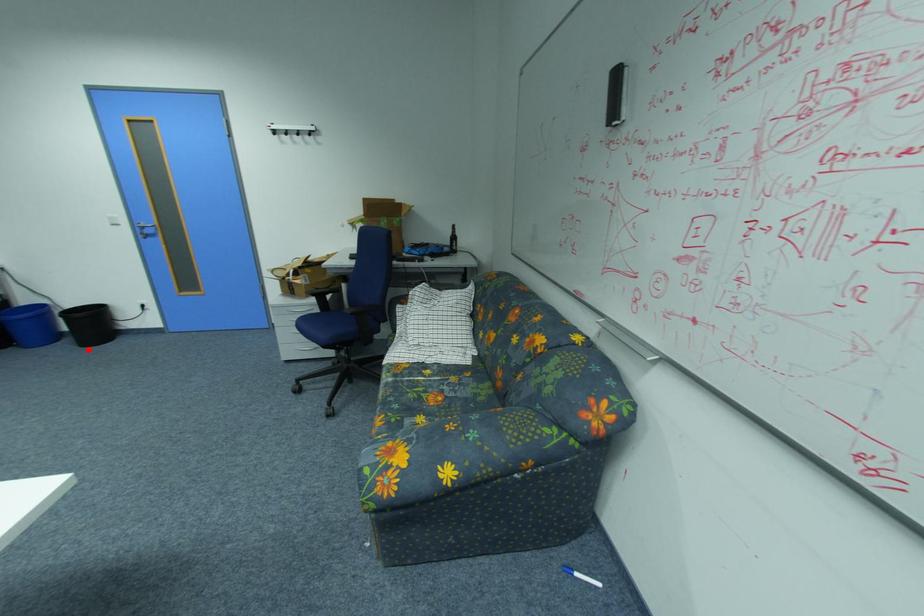
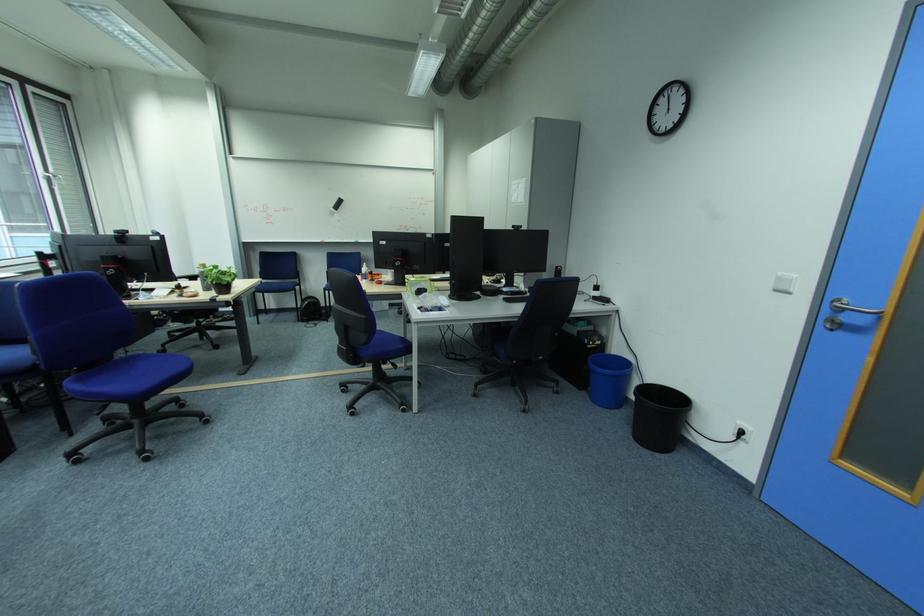
Question: I am providing you with two images of the same scene from different viewpoints. Image1 has a red point marked. In image2, the corresponding 3D location appears at what relative position? Reply with the corresponding letter.

Choices:
 (A) Closer
 (B) Farther

Answer: (B)